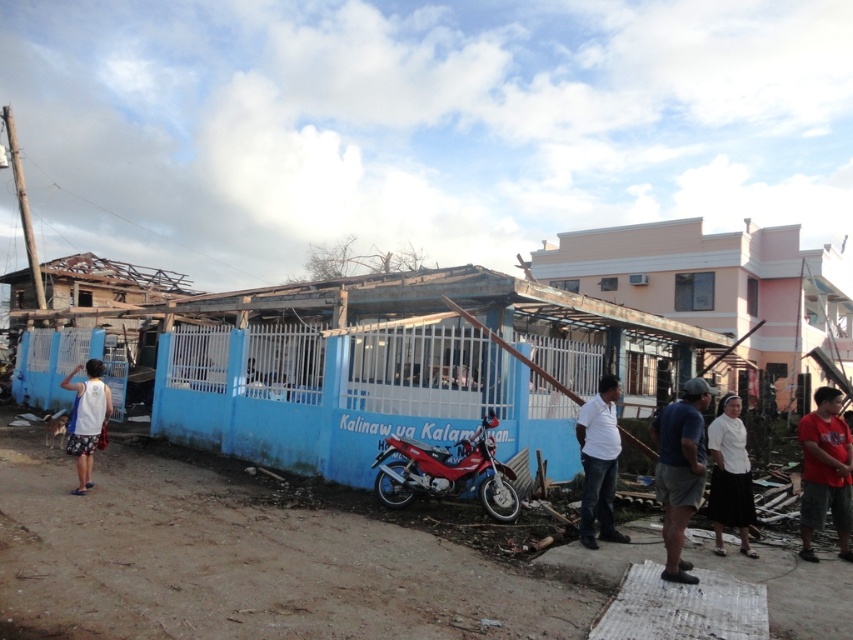
You are a delivery person who needs to deliver a package to the address marked at point (x=598, y=461). You see a white cotton shirt at center. Is the white cotton shirt at center located at the delivery point?

Yes, the white cotton shirt at center is located at point (x=598, y=461), which is the delivery address.

You are a delivery person needing to load a box onto the red matte motorcycle at center. The box requires that it must be placed on a surface taller than the brown fabric shorts at lower right. Can you place the box on the motorcycle?

The red matte motorcycle at center is shorter than the brown fabric shorts at lower right. Since the box needs to be placed on a surface taller than the brown fabric shorts at lower right, the motorcycle is not tall enough. Therefore, you cannot place the box on the motorcycle.